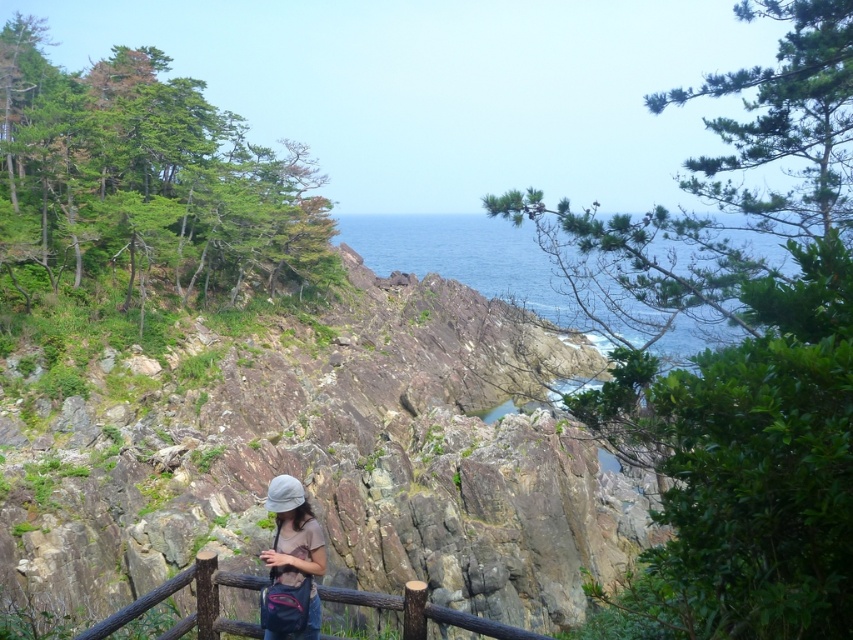
You are standing at the viewpoint looking at the coastal cliffs. There are two points marked in the scene. The first point is at coordinates point (x=683, y=323) and the second point is at point (x=405, y=627). Which of these two points is closer to your current position?

Point (x=683, y=323) is further to the camera than point (x=405, y=627). Therefore, the point closer to your current position is point (x=405, y=627).